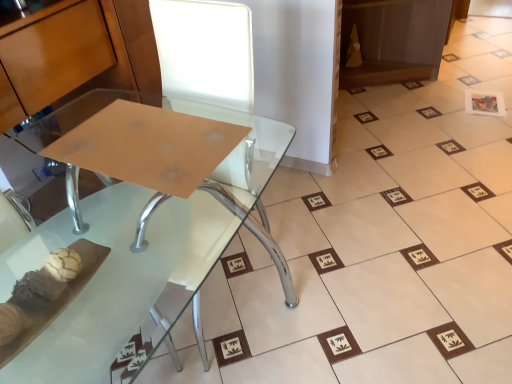
Question: Is clear glass table at center looking in the opposite direction of white paper at upper right?

Choices:
 (A) no
 (B) yes

Answer: (A)

Question: Is clear glass table at center at the right side of white paper at upper right?

Choices:
 (A) yes
 (B) no

Answer: (B)

Question: Considering the relative sizes of clear glass table at center and white paper at upper right in the image provided, is clear glass table at center thinner than white paper at upper right?

Choices:
 (A) no
 (B) yes

Answer: (A)

Question: Can you confirm if clear glass table at center is wider than white paper at upper right?

Choices:
 (A) no
 (B) yes

Answer: (B)

Question: From a real-world perspective, does clear glass table at center stand above white paper at upper right?

Choices:
 (A) no
 (B) yes

Answer: (B)

Question: Is clear glass table at center shorter than white paper at upper right?

Choices:
 (A) no
 (B) yes

Answer: (A)

Question: Is white paper at upper right not close to clear glass table at center?

Choices:
 (A) no
 (B) yes

Answer: (B)

Question: Is white paper at upper right surrounding clear glass table at center?

Choices:
 (A) yes
 (B) no

Answer: (B)

Question: Considering the relative sizes of white paper at upper right and clear glass table at center in the image provided, is white paper at upper right bigger than clear glass table at center?

Choices:
 (A) yes
 (B) no

Answer: (B)

Question: Are white paper at upper right and clear glass table at center beside each other?

Choices:
 (A) yes
 (B) no

Answer: (B)

Question: Does white paper at upper right have a greater height compared to clear glass table at center?

Choices:
 (A) no
 (B) yes

Answer: (A)

Question: Is clear glass table at center at the back of white paper at upper right?

Choices:
 (A) yes
 (B) no

Answer: (B)

Question: Is clear glass table at center bigger or smaller than white paper at upper right?

Choices:
 (A) big
 (B) small

Answer: (A)